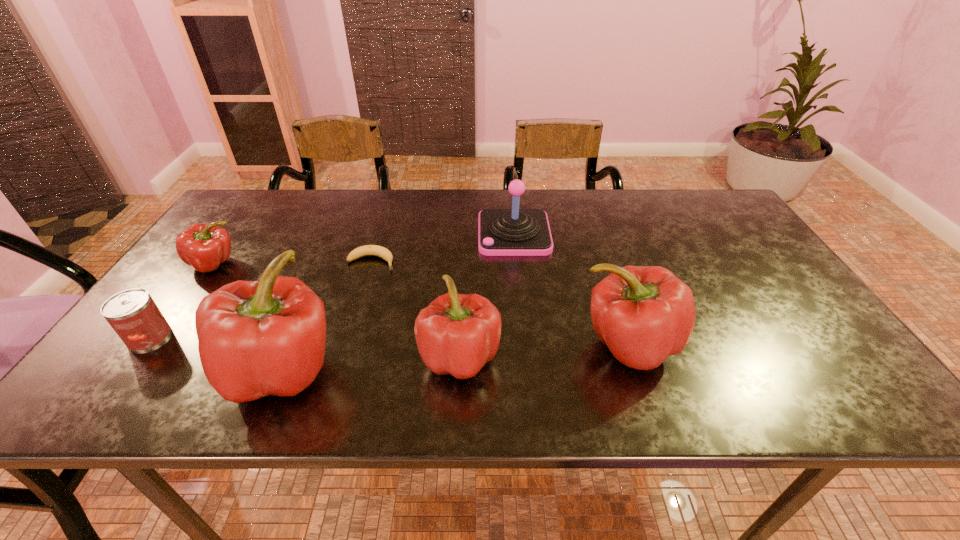
The height and width of the screenshot is (540, 960). I want to click on vacant area located 0.080m on the right of the rightmost bell pepper, so click(x=712, y=345).

Find the location of `vacant space located on the back of the pepper`. vacant space located on the back of the pepper is located at coordinates (247, 218).

The width and height of the screenshot is (960, 540). I want to click on vacant point located forward from the base of the joystick, so click(428, 234).

Where is `vacant space located 0.160m forward from the base of the joystick`? vacant space located 0.160m forward from the base of the joystick is located at coordinates (424, 234).

Where is `vacant space situated 0.050m forward from the base of the joystick`? The width and height of the screenshot is (960, 540). vacant space situated 0.050m forward from the base of the joystick is located at coordinates (462, 234).

Image resolution: width=960 pixels, height=540 pixels. Find the location of `vacant area situated 0.200m on the back of the shortest object`. vacant area situated 0.200m on the back of the shortest object is located at coordinates [x=386, y=213].

You are a GUI agent. You are given a task and a screenshot of the screen. Output one action in this format:
    pyautogui.click(x=<x>, y=<y>)
    Task: Click on the vacant space situated on the right of the can
    This screenshot has height=540, width=960.
    Given the screenshot: What is the action you would take?
    pyautogui.click(x=265, y=337)

What are the coordinates of `object located in the far edge section of the desktop` in the screenshot? It's located at (502, 232).

The height and width of the screenshot is (540, 960). What are the coordinates of `can at the near edge` in the screenshot? It's located at (133, 314).

You are a GUI agent. You are given a task and a screenshot of the screen. Output one action in this format:
    pyautogui.click(x=<x>, y=<y>)
    Task: Click on the pepper that is at the left edge
    
    Given the screenshot: What is the action you would take?
    pyautogui.click(x=205, y=246)